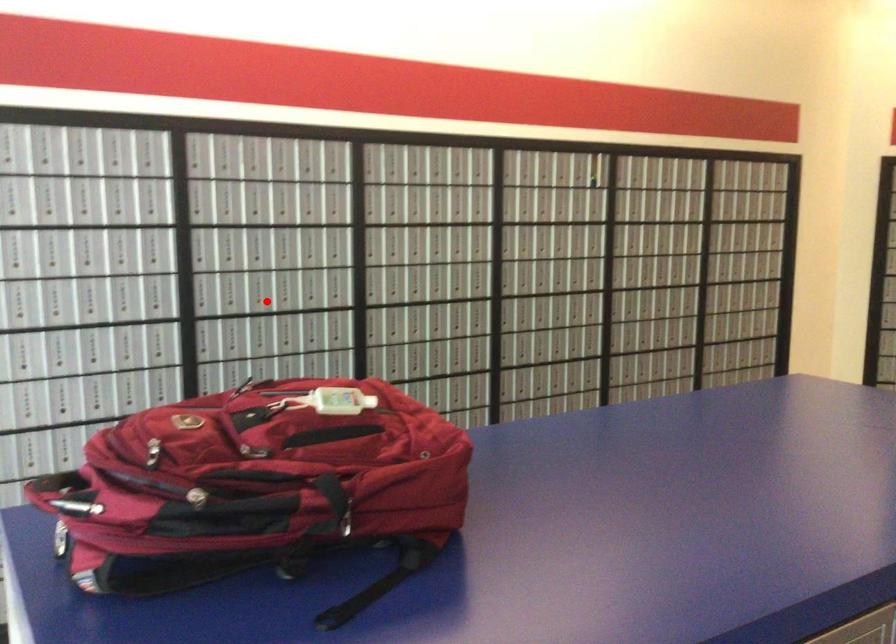
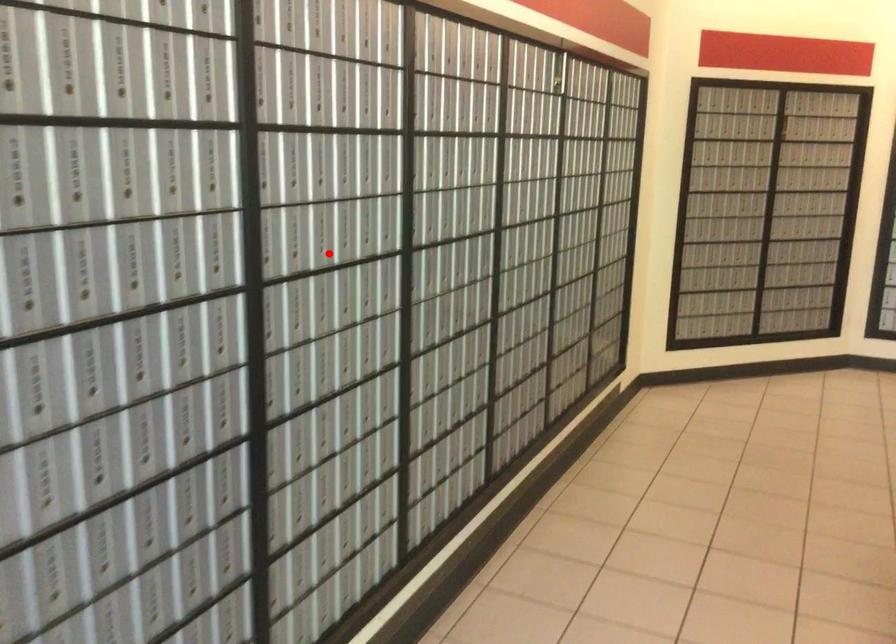
I am providing you with two images of the same scene from different viewpoints. A red point is marked on the first image and another point is marked on the second image. Do the highlighted points in image1 and image2 indicate the same real-world spot?

Yes